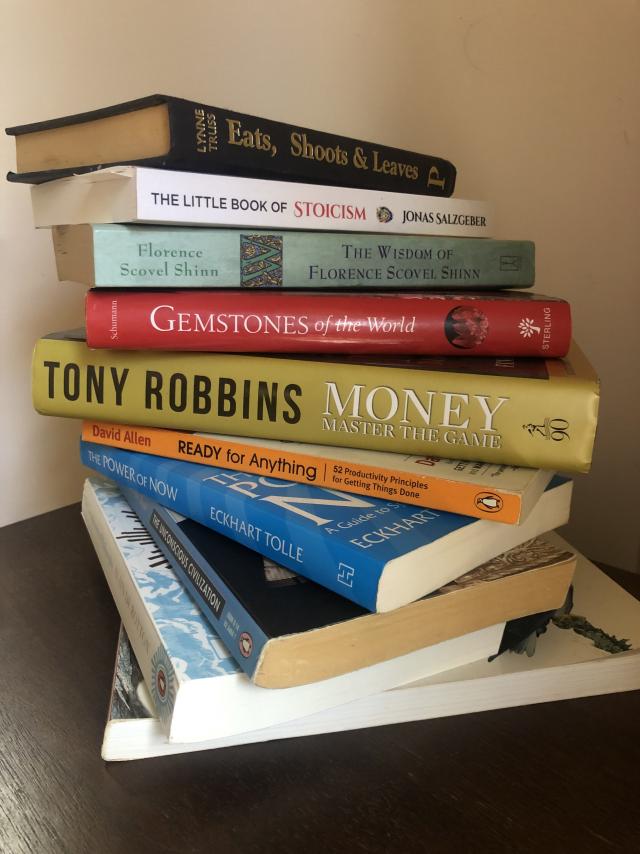
Image resolution: width=640 pixels, height=854 pixels. In order to click on books in this screenshot , I will do `click(136, 727)`, `click(195, 657)`, `click(236, 607)`, `click(280, 535)`, `click(307, 465)`, `click(305, 400)`, `click(300, 330)`, `click(300, 244)`, `click(300, 192)`, `click(304, 154)`.